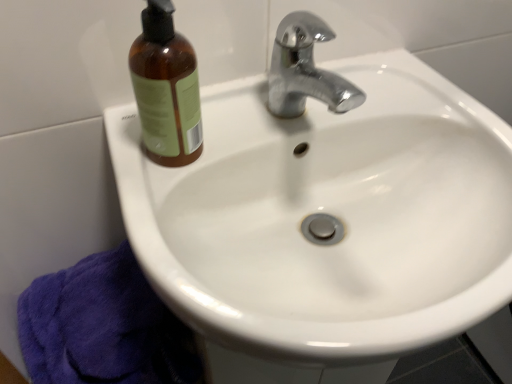
At what (x,y) coordinates should I click in order to perform the action: click on free space in front of brown glass bottle at upper left. Please return your answer as a coordinate pair (x, y). Image resolution: width=512 pixels, height=384 pixels. Looking at the image, I should click on (158, 228).